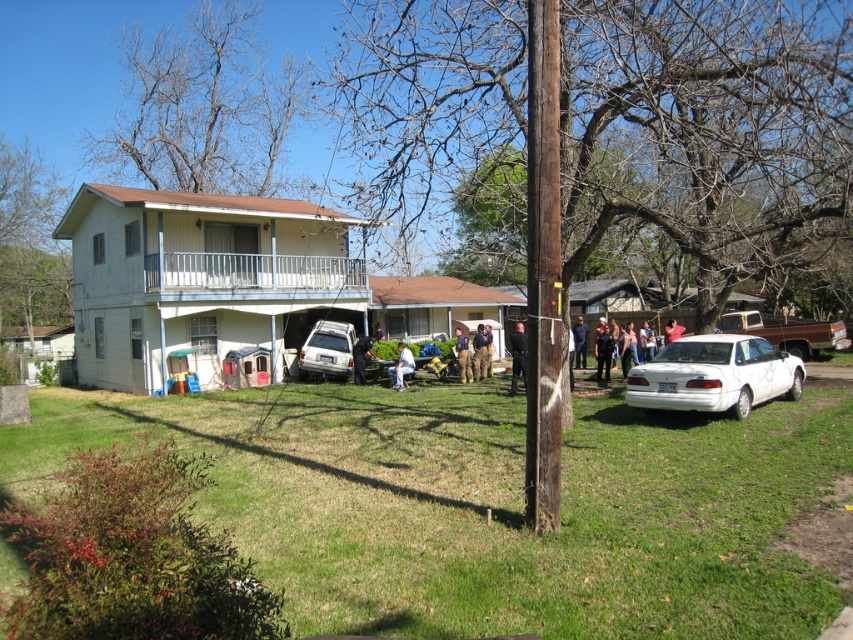
You are a delivery person trying to park your white matte van at center in the driveway. There is a white fabric chair at center in the way. Can the van go around the chair without moving it?

The white matte van at center is much taller than the white fabric chair at center, so the van can go around the chair without moving it as the chair is shorter and easier to navigate around.

You are planning to park your car in the driveway. You see a white matte van at center and a white fabric chair at center. Which object should you move to make space?

The white matte van at center might be wider than the white fabric chair at center, so you should move the white fabric chair at center to make space for parking.

You are a delivery person trying to park your white matte van at center in the driveway. There is a white fabric chair at center in the way. Can you move the van past the chair without lifting it?

The white matte van at center is above the white fabric chair at center, so the van is already positioned higher than the chair. This means you can drive the van past the chair without needing to lift it since it can simply move over the chair from its elevated position.